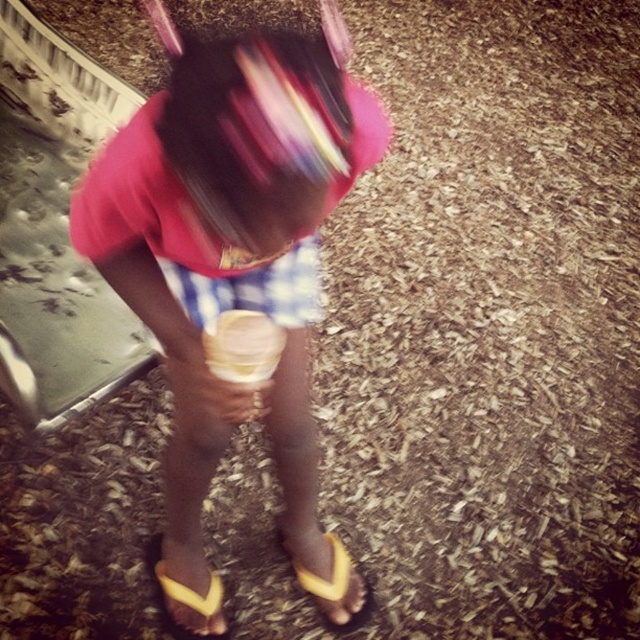
Question: Can you confirm if yellow flip-flops at lower center is positioned to the right of yellow rubber sandal at lower center?

Choices:
 (A) no
 (B) yes

Answer: (B)

Question: Which of the following is the farthest from the observer?

Choices:
 (A) (218, 637)
 (B) (195, 451)
 (C) (346, 595)

Answer: (C)

Question: Is yellow flip-flops at lower center thinner than yellow rubber sandal at lower center?

Choices:
 (A) yes
 (B) no

Answer: (B)

Question: Can you confirm if yellow flip-flops at lower center is positioned to the left of yellow flip-flop at lower center?

Choices:
 (A) no
 (B) yes

Answer: (B)

Question: Which object appears farthest from the camera in this image?

Choices:
 (A) yellow flip-flops at lower center
 (B) yellow flip-flop at lower center

Answer: (B)

Question: Which object is closer to the camera taking this photo?

Choices:
 (A) yellow rubber sandal at lower center
 (B) yellow flip-flop at lower center

Answer: (A)